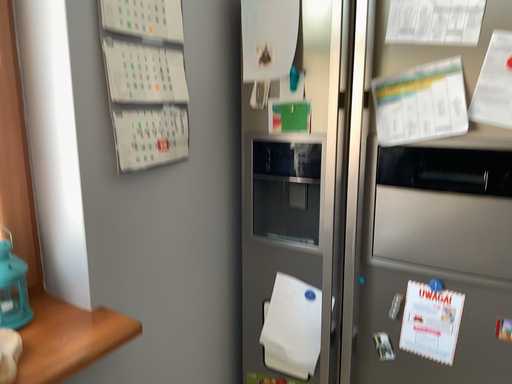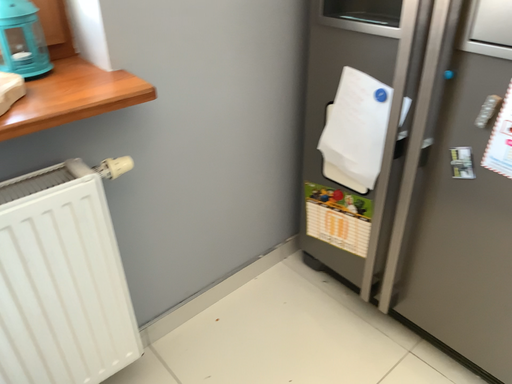
Question: How did the camera likely rotate when shooting the video?

Choices:
 (A) rotated left
 (B) rotated right

Answer: (A)